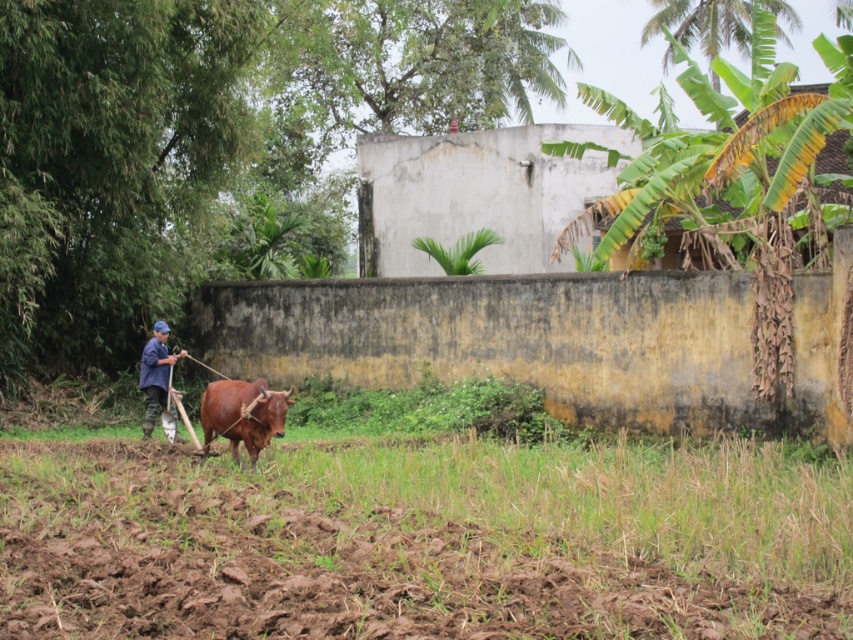
Can you confirm if green grass at lower center is wider than blue fabric shirt at left?

Yes, green grass at lower center is wider than blue fabric shirt at left.

Is point (285, 586) positioned before point (154, 410)?

Yes, point (285, 586) is closer to viewer.

Where is `green grass at lower center`? Image resolution: width=853 pixels, height=640 pixels. green grass at lower center is located at coordinates (405, 545).

Is green grass at lower center smaller than brown leather bull at center?

No, green grass at lower center is not smaller than brown leather bull at center.

Is point (637, 627) closer to camera compared to point (206, 401)?

Yes.

This screenshot has width=853, height=640. Identify the location of green grass at lower center. (405, 545).

In order to click on green grass at lower center in this screenshot , I will do `click(405, 545)`.

Is point (231, 388) positioned before point (164, 355)?

Yes, it is.

Can you confirm if brown leather bull at center is thinner than blue fabric shirt at left?

No, brown leather bull at center is not thinner than blue fabric shirt at left.

Which is behind, point (202, 401) or point (146, 433)?

The point (146, 433) is more distant.

Image resolution: width=853 pixels, height=640 pixels. What are the coordinates of `brown leather bull at center` in the screenshot? It's located at (242, 413).